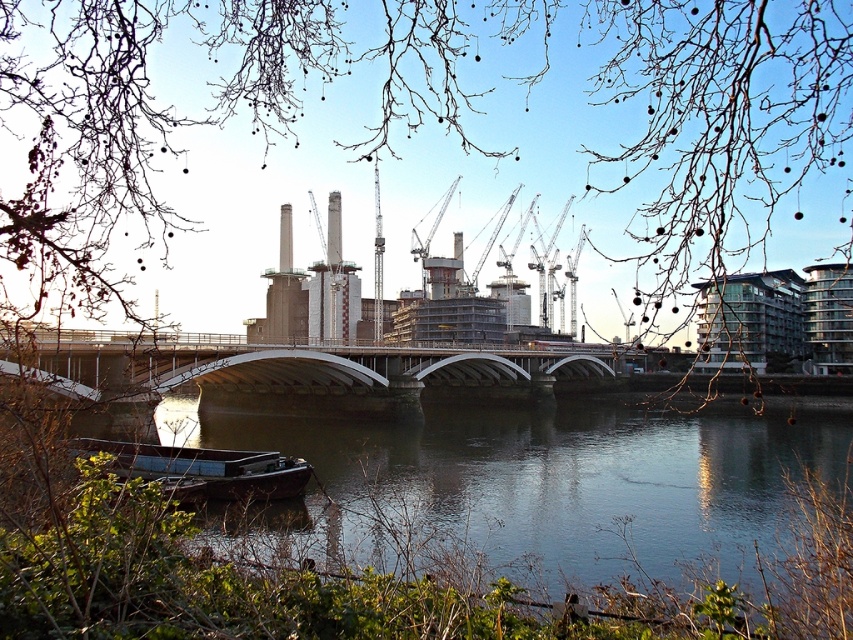
Can you confirm if white concrete bridge at center is positioned to the left of wooden boat at lower left?

No, white concrete bridge at center is not to the left of wooden boat at lower left.

Can you confirm if white concrete bridge at center is shorter than wooden boat at lower left?

Incorrect, white concrete bridge at center's height does not fall short of wooden boat at lower left's.

Who is more distant from viewer, [438,384] or [161,458]?

Positioned behind is point [438,384].

Locate an element on the screen. white concrete bridge at center is located at coordinates (299, 365).

Looking at this image, does clear water at lower left have a lesser width compared to wooden boat at lower left?

Incorrect, clear water at lower left's width is not less than wooden boat at lower left's.

Which is above, clear water at lower left or wooden boat at lower left?

wooden boat at lower left is higher up.

The height and width of the screenshot is (640, 853). I want to click on clear water at lower left, so click(x=549, y=493).

The image size is (853, 640). Identify the location of clear water at lower left. (549, 493).

Between point (498, 445) and point (299, 358), which one is positioned behind?

Positioned behind is point (498, 445).

What do you see at coordinates (549, 493) in the screenshot? The image size is (853, 640). I see `clear water at lower left` at bounding box center [549, 493].

Locate an element on the screen. The image size is (853, 640). clear water at lower left is located at coordinates (549, 493).